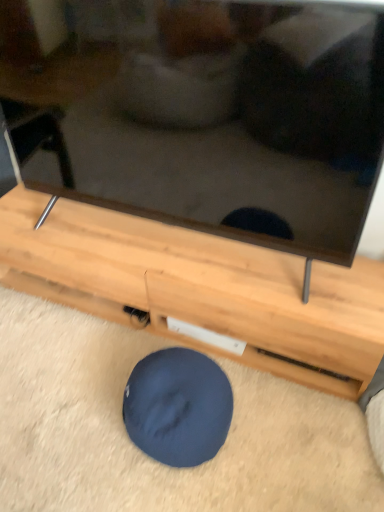
What are the coordinates of `vacant space to the left of dark blue fabric dog bed at lower center` in the screenshot? It's located at (79, 419).